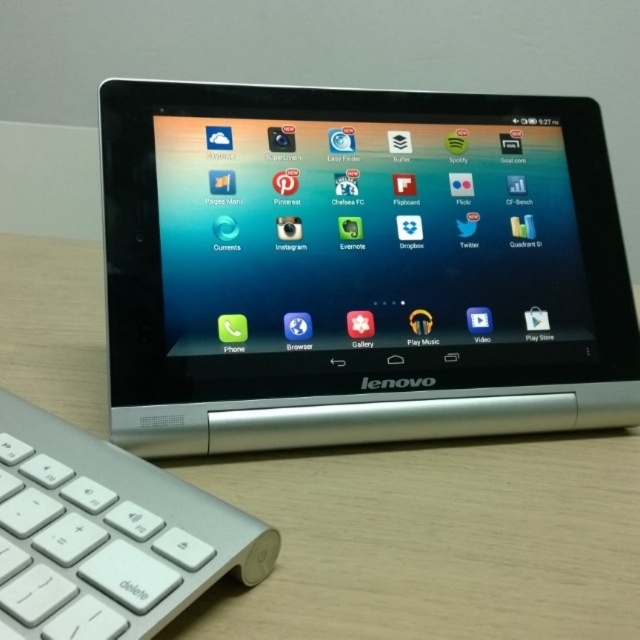
You are setting up a workspace and need to place the silver metallic tablet at center and the white plastic keyboard at lower left on a desk. Given their sizes, which object will occupy more vertical space on the desk?

The silver metallic tablet at center has a greater height compared to the white plastic keyboard at lower left, so it will occupy more vertical space on the desk.

Based on the photo, you are setting up a workspace and need to place both the wooden table at center and the white plastic keyboard at lower left on a shelf. Which object should you place first to ensure they both fit?

The wooden table at center is wider than the white plastic keyboard at lower left, so you should place the wooden table at center first to ensure both fit on the shelf.

You are holding a wireless mouse that requires a minimum of 40 centimeters of space to operate comfortably. You are standing in front of the wooden table at center. Can you use the mouse here?

The wooden table at center and viewer are 37.54 centimeters apart from each other, which is less than the required 40 centimeters. Therefore, you cannot use the mouse here comfortably.